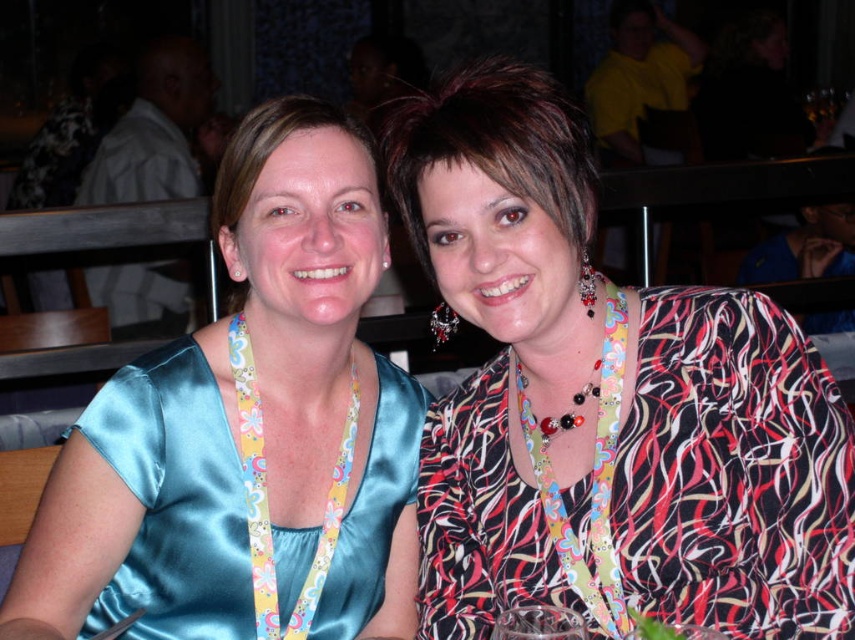
Between printed silk blouse at center and satin dress at left, which one appears on the right side from the viewer's perspective?

Positioned to the right is printed silk blouse at center.

Is printed silk blouse at center positioned behind satin dress at left?

No.

Where is `printed silk blouse at center`? printed silk blouse at center is located at coordinates (606, 403).

Find the location of a particular element. Image resolution: width=855 pixels, height=640 pixels. printed silk blouse at center is located at coordinates coord(606,403).

Is point (369, 221) closer to viewer compared to point (152, 422)?

No, it is behind (152, 422).

Image resolution: width=855 pixels, height=640 pixels. Identify the location of satin blue dress at center. (248, 432).

Is point (450, 192) farther from camera compared to point (103, 448)?

That is False.

Between point (699, 349) and point (308, 582), which one is positioned behind?

The point (308, 582) is more distant.

Between point (493, 618) and point (373, 168), which one is positioned in front?

Point (493, 618)

Locate an element on the screen. printed silk blouse at center is located at coordinates (606, 403).